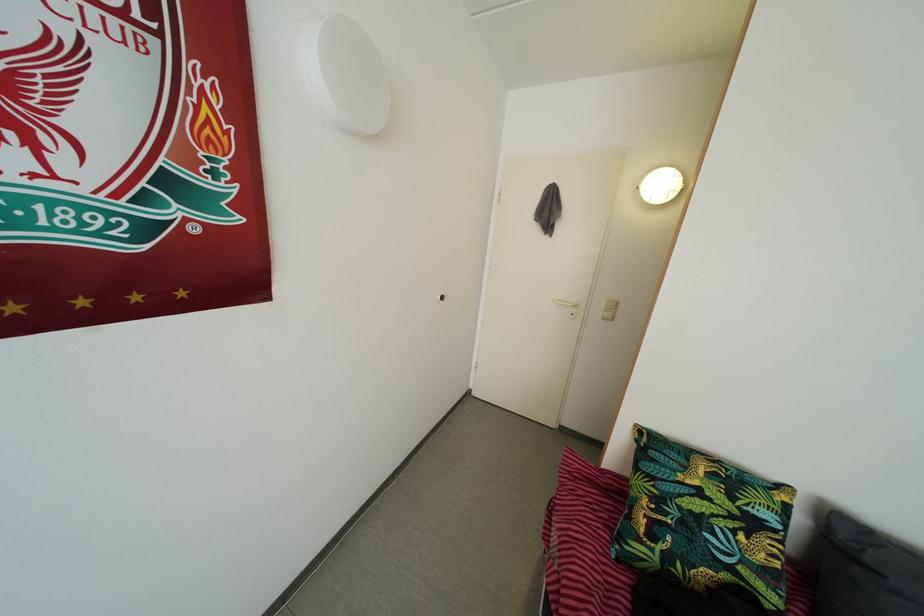
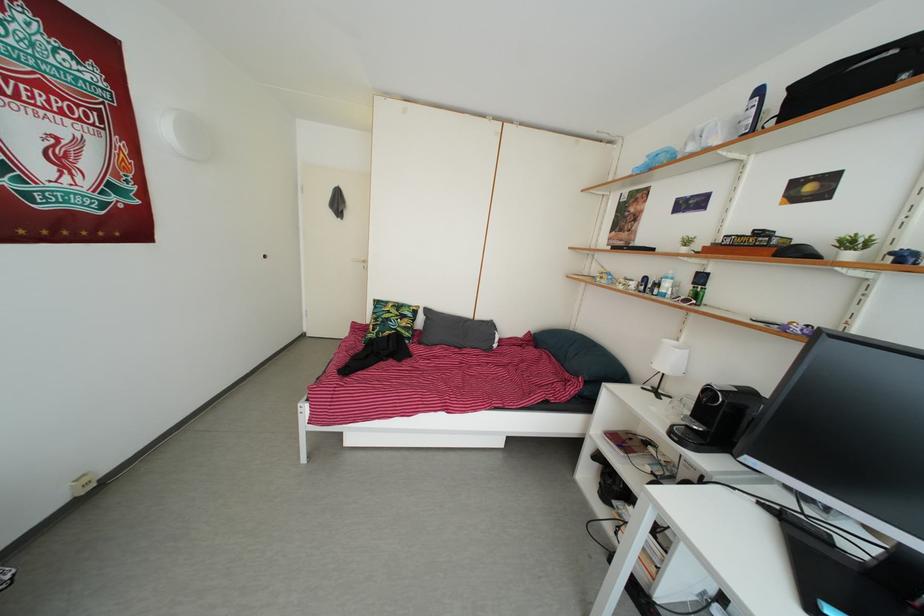
Locate, in the second image, the point that corresponds to point (688, 531) in the first image.

(388, 330)